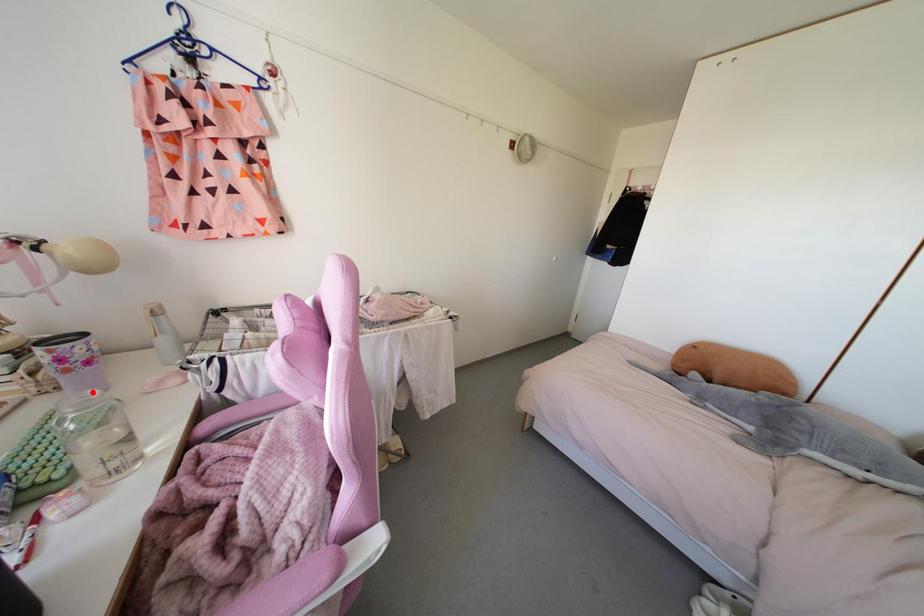
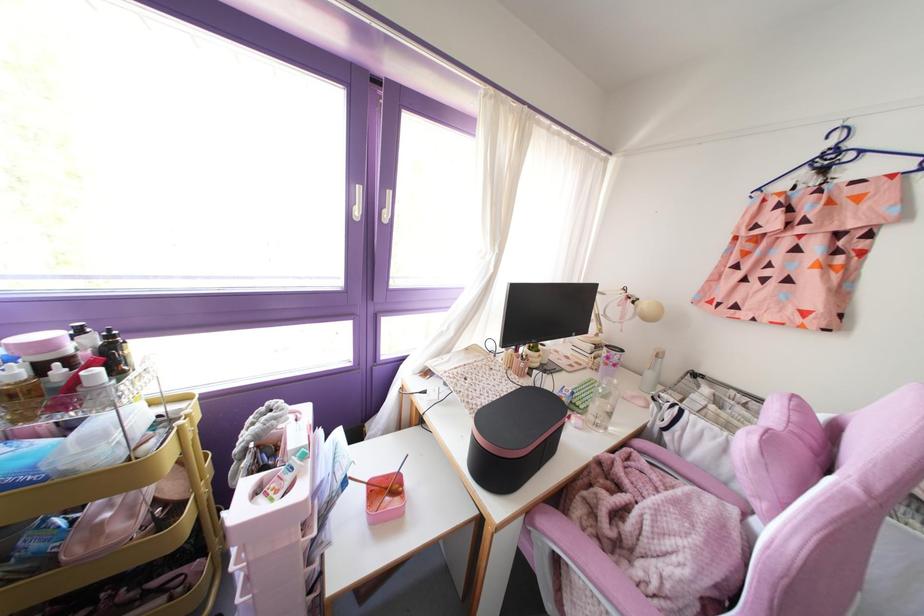
The point at the highlighted location is marked in the first image. Where is the corresponding point in the second image?

(614, 381)